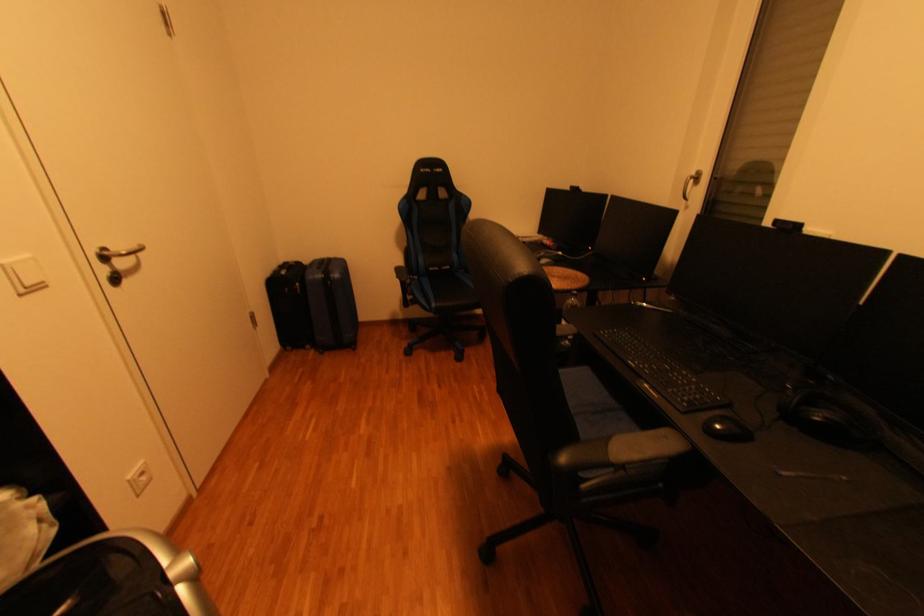
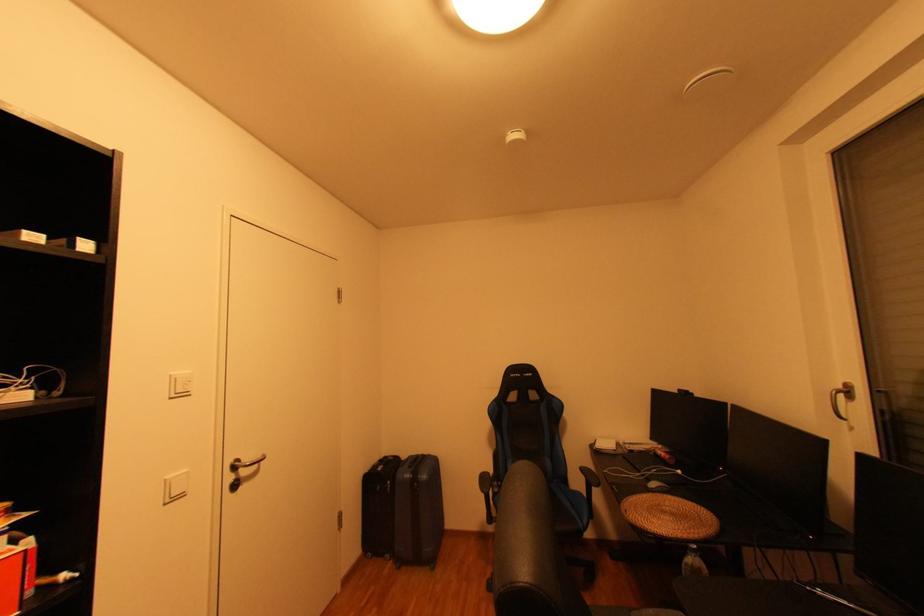
In the second image, find the point that corresponds to [322,351] in the first image.

(400, 562)